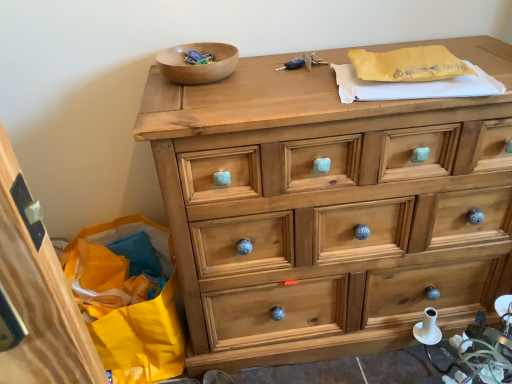
The image size is (512, 384). In order to click on light brown wood chest of drawers at center in this screenshot , I will do tap(329, 208).

This screenshot has width=512, height=384. What do you see at coordinates (329, 208) in the screenshot? I see `light brown wood chest of drawers at center` at bounding box center [329, 208].

The width and height of the screenshot is (512, 384). What do you see at coordinates (198, 65) in the screenshot?
I see `wooden bowl at upper center` at bounding box center [198, 65].

Where is `wooden bowl at upper center`? Image resolution: width=512 pixels, height=384 pixels. wooden bowl at upper center is located at coordinates (x=198, y=65).

Measure the distance between point (215, 44) and camera.

Point (215, 44) and camera are 1.19 meters apart from each other.

Image resolution: width=512 pixels, height=384 pixels. I want to click on light brown wood chest of drawers at center, so click(x=329, y=208).

Which is more to the left, wooden bowl at upper center or light brown wood chest of drawers at center?

wooden bowl at upper center.

In the image, is wooden bowl at upper center positioned in front of or behind light brown wood chest of drawers at center?

In the image, wooden bowl at upper center appears behind light brown wood chest of drawers at center.

Does point (230, 67) appear closer or farther from the camera than point (253, 202)?

Point (230, 67).

From the image's perspective, does wooden bowl at upper center appear lower than light brown wood chest of drawers at center?

No.

From a real-world perspective, is wooden bowl at upper center positioned above or below light brown wood chest of drawers at center?

wooden bowl at upper center is above light brown wood chest of drawers at center.

Looking at their sizes, would you say wooden bowl at upper center is wider or thinner than light brown wood chest of drawers at center?

In the image, wooden bowl at upper center appears to be more narrow than light brown wood chest of drawers at center.

Can you confirm if wooden bowl at upper center is taller than light brown wood chest of drawers at center?

No.

Does wooden bowl at upper center have a larger size compared to light brown wood chest of drawers at center?

No, wooden bowl at upper center is not bigger than light brown wood chest of drawers at center.

Is wooden bowl at upper center not within light brown wood chest of drawers at center?

wooden bowl at upper center is positioned outside light brown wood chest of drawers at center.

Would you consider wooden bowl at upper center to be distant from light brown wood chest of drawers at center?

No, wooden bowl at upper center is not far from light brown wood chest of drawers at center.

Is light brown wood chest of drawers at center at the back of wooden bowl at upper center?

wooden bowl at upper center is not turned away from light brown wood chest of drawers at center.

What's the angular difference between wooden bowl at upper center and light brown wood chest of drawers at center's facing directions?

The angular difference between wooden bowl at upper center and light brown wood chest of drawers at center is 2.69 degrees.

Where is `bowl that appears above the light brown wood chest of drawers at center (from the image's perspective)`? bowl that appears above the light brown wood chest of drawers at center (from the image's perspective) is located at coordinates (198, 65).

Between light brown wood chest of drawers at center and wooden bowl at upper center, which one appears on the right side from the viewer's perspective?

From the viewer's perspective, light brown wood chest of drawers at center appears more on the right side.

Considering their positions, is light brown wood chest of drawers at center located in front of or behind wooden bowl at upper center?

Visually, light brown wood chest of drawers at center is located in front of wooden bowl at upper center.

Between point (217, 196) and point (216, 51), which one is positioned in front?

The point (217, 196) is closer.

From the image's perspective, is light brown wood chest of drawers at center below wooden bowl at upper center?

Indeed, from the image's perspective, light brown wood chest of drawers at center is shown beneath wooden bowl at upper center.

From a real-world perspective, who is located lower, light brown wood chest of drawers at center or wooden bowl at upper center?

In real-world perspective, light brown wood chest of drawers at center is lower.

Is light brown wood chest of drawers at center wider than wooden bowl at upper center?

Yes, light brown wood chest of drawers at center is wider than wooden bowl at upper center.

Who is shorter, light brown wood chest of drawers at center or wooden bowl at upper center?

With less height is wooden bowl at upper center.

Who is smaller, light brown wood chest of drawers at center or wooden bowl at upper center?

Smaller between the two is wooden bowl at upper center.

Choose the correct answer: Is light brown wood chest of drawers at center inside wooden bowl at upper center or outside it?

The correct answer is: outside.

Is there a large distance between light brown wood chest of drawers at center and wooden bowl at upper center?

No, light brown wood chest of drawers at center is not far from wooden bowl at upper center.

Is light brown wood chest of drawers at center oriented towards wooden bowl at upper center?

No.

Locate an element on the screen. bowl behind the light brown wood chest of drawers at center is located at coordinates pyautogui.click(x=198, y=65).

The height and width of the screenshot is (384, 512). Find the location of `bowl behind the light brown wood chest of drawers at center`. bowl behind the light brown wood chest of drawers at center is located at coordinates (198, 65).

In the image, there is a wooden bowl at upper center. What are the coordinates of `the chest of drawers below it (from a real-world perspective)` in the screenshot? It's located at [x=329, y=208].